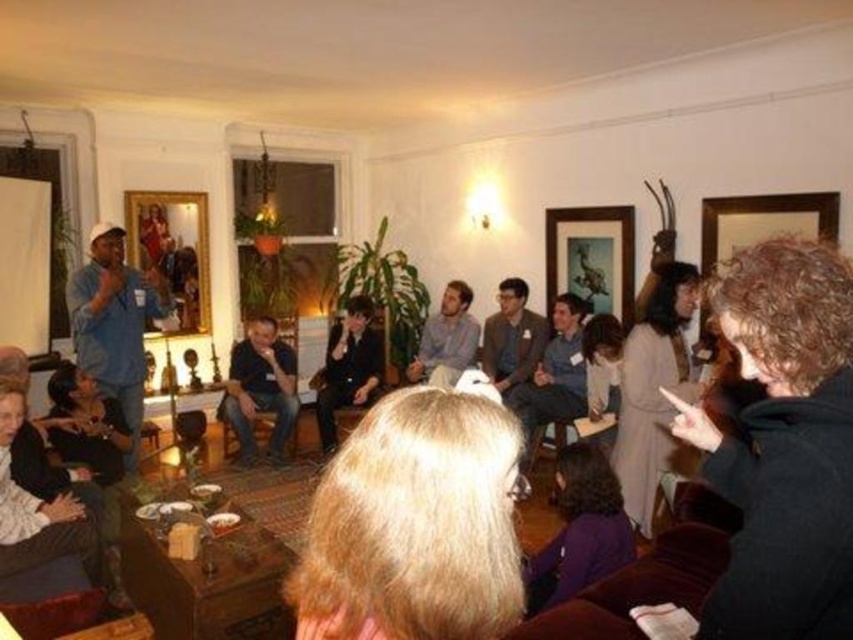
Question: Based on their relative distances, which object is nearer to the wooden framed artwork at upper center?

Choices:
 (A) curly brown hair at lower right
 (B) blonde hair at center
 (C) blue denim shirt at left

Answer: (C)

Question: Is curly brown hair at lower right positioned behind blue denim shirt at left?

Choices:
 (A) no
 (B) yes

Answer: (A)

Question: Considering the real-world distances, which object is farthest from the curly brown hair at lower right?

Choices:
 (A) dark purple sweater at lower center
 (B) blue denim shirt at left

Answer: (B)

Question: Which point is farther from the camera taking this photo?

Choices:
 (A) (467, 323)
 (B) (122, 228)
 (C) (477, 605)
 (D) (178, 296)

Answer: (D)

Question: Considering the relative positions of dark blue shirt at center and dark gray sweater at center in the image provided, where is dark blue shirt at center located with respect to dark gray sweater at center?

Choices:
 (A) right
 (B) left

Answer: (B)

Question: Does blonde hair at center have a smaller size compared to dark blue shirt at center?

Choices:
 (A) no
 (B) yes

Answer: (B)